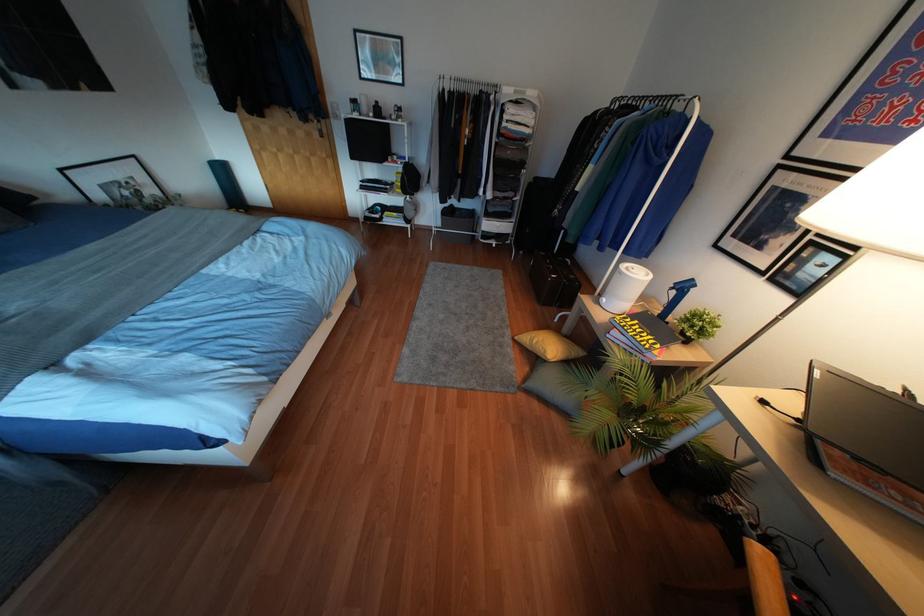
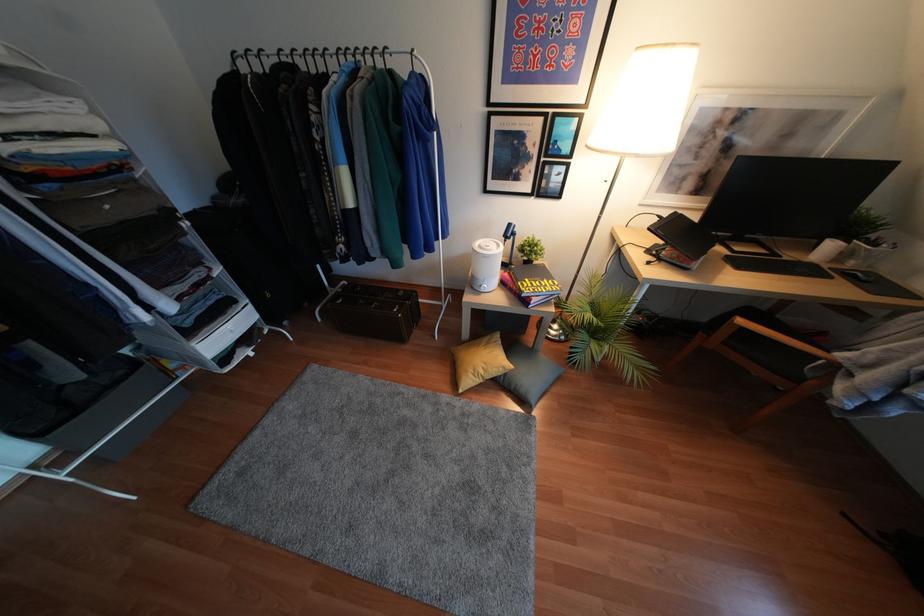
Where in the second image is the point corresponding to point 533,341 from the first image?

(480, 371)